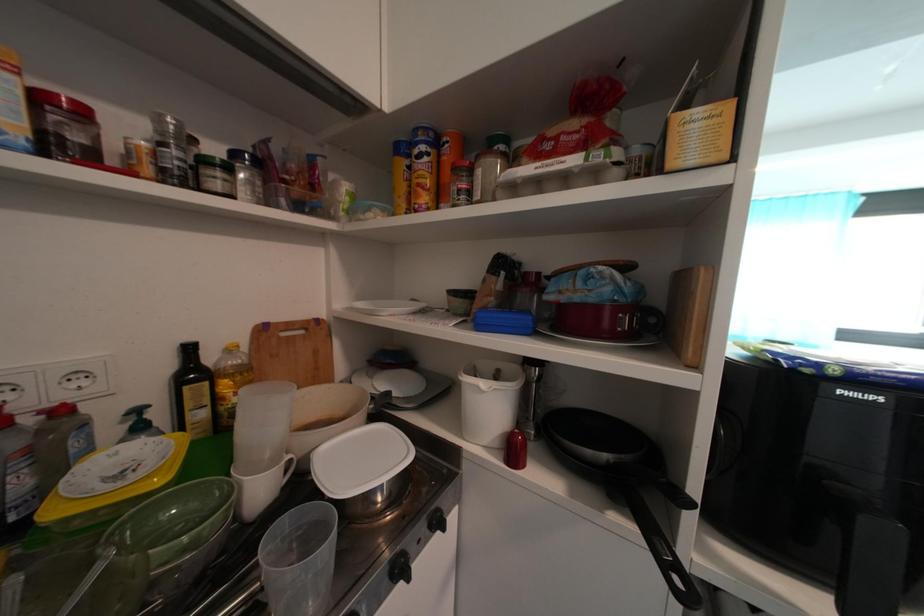
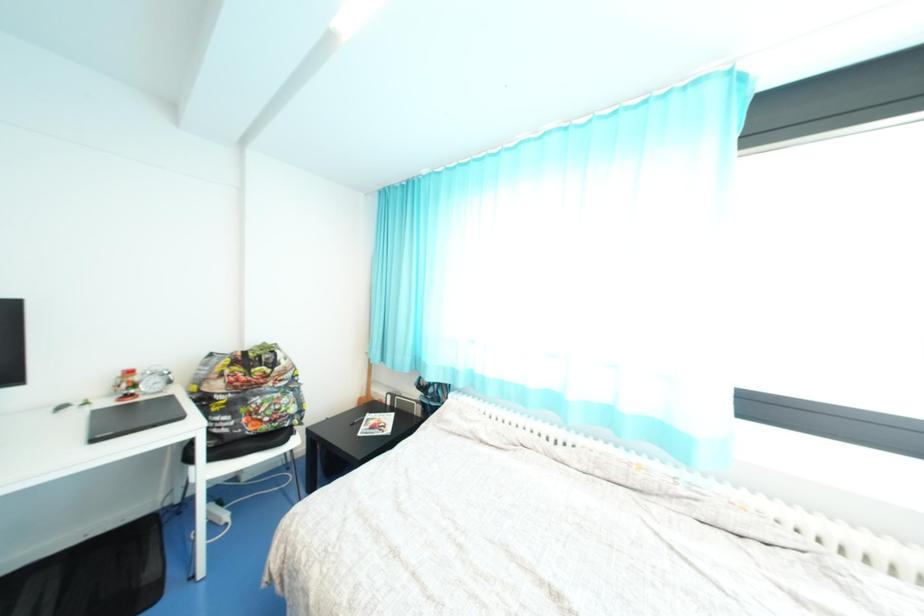
The images are taken continuously from a first-person perspective. In which direction are you moving?

The cameraman walked toward right, forward.